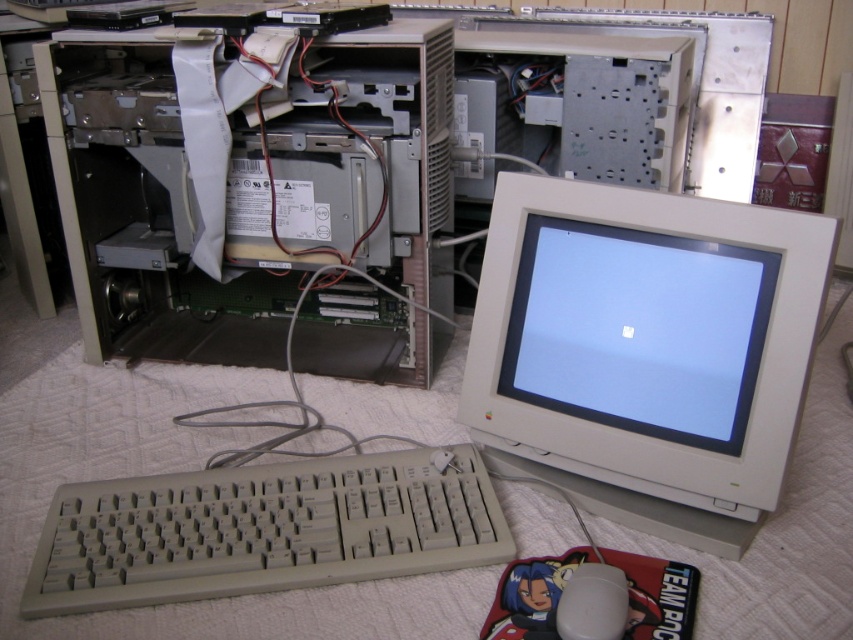
You are a technician trying to connect a new USB cable to the beige plastic keyboard at lower left and the white matte mouse at lower center. The cable you have is 10 inches long. Will it be long enough to reach both devices?

The beige plastic keyboard at lower left and white matte mouse at lower center are 10.19 inches apart. The cable is only 10 inches long, so it will be 0.19 inches too short to reach both devices.

You are a technician inspecting the vintage computer setup. You need to access the silver metallic computer at center and the beige plastic keyboard at lower left. Which object is closer to you, the technician, allowing easier access?

The silver metallic computer at center is closer to you, making it easier to access than the beige plastic keyboard at lower left.

You are a technician trying to access both point (369, 253) and point (49, 525) inside the open computer tower. Which point is closer to you when looking into the tower?

Point (369, 253) is closer to you than point (49, 525) because it is further to the viewer.